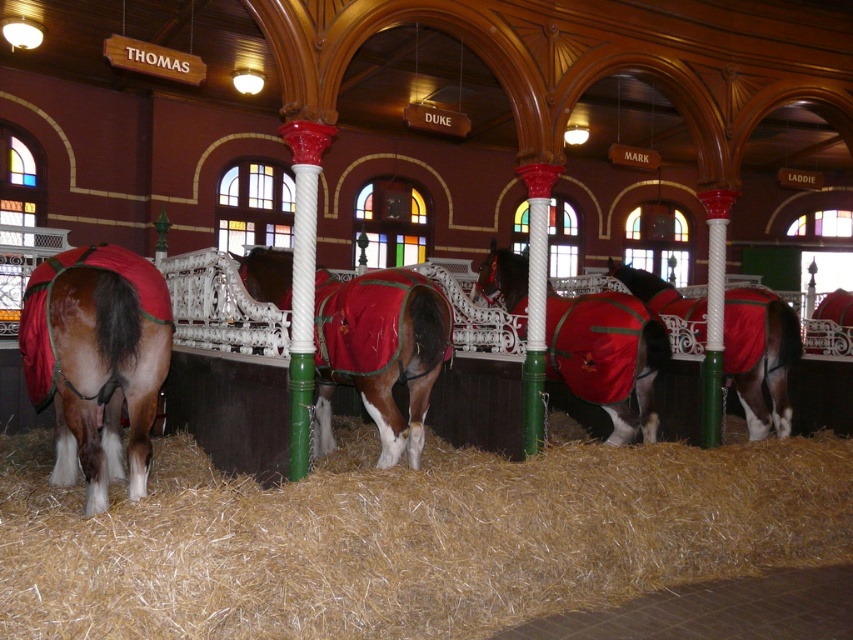
You are standing inside the stable and want to determine which of the two points, point (737, 481) or point (628, 275), is nearer to you. Can you figure out which one is closer?

Point (737, 481) is closer to the viewer than point (628, 275).